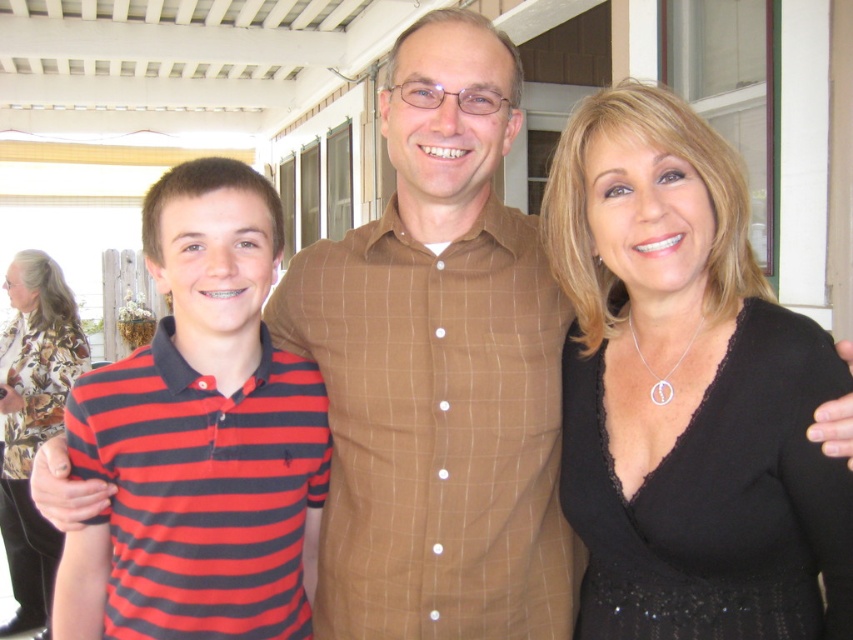
You are standing in front of the group of three people in the image. There are two points marked in the scene. The first point is at coordinate point [281,243] and the second point is at coordinate point [41,566]. Which point is closer to you?

Point [281,243] is closer to the viewer than point [41,566].

Based on the scene description, which clothing item is taller, the black lace dress at center or the striped cotton polo shirt at left?

The black lace dress at center is much taller than the striped cotton polo shirt at left according to the description.

You are a photographer setting up for a group photo. You need to ensure there is enough space between the black lace dress at center and the brown checkered shirt at center so that the camera can focus properly. The minimum required distance for clear focus is 10 inches. Is the current distance sufficient?

The black lace dress at center is 9.50 inches away from the brown checkered shirt at center, which is less than the required 10 inches for clear focus. Therefore, the distance is insufficient, and the subjects should move slightly farther apart.